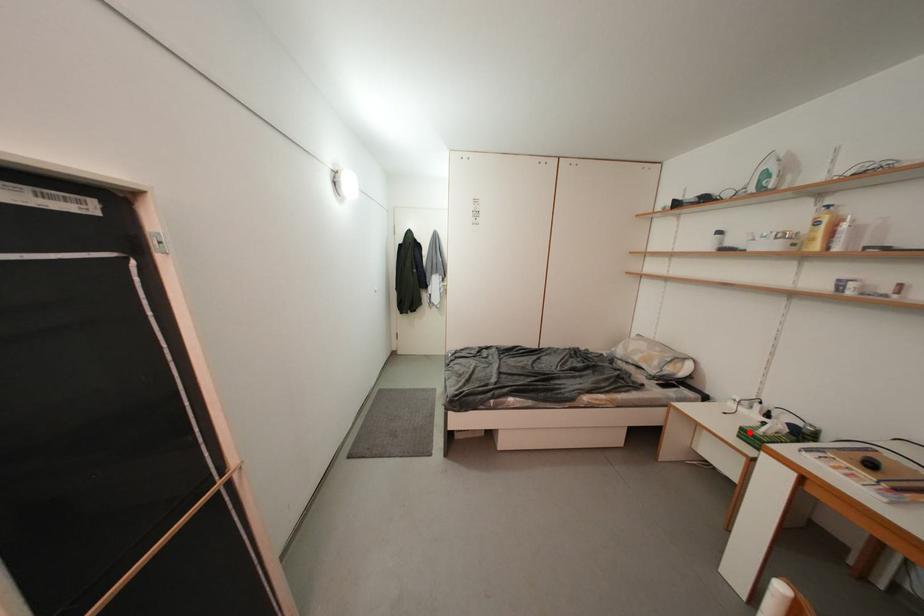
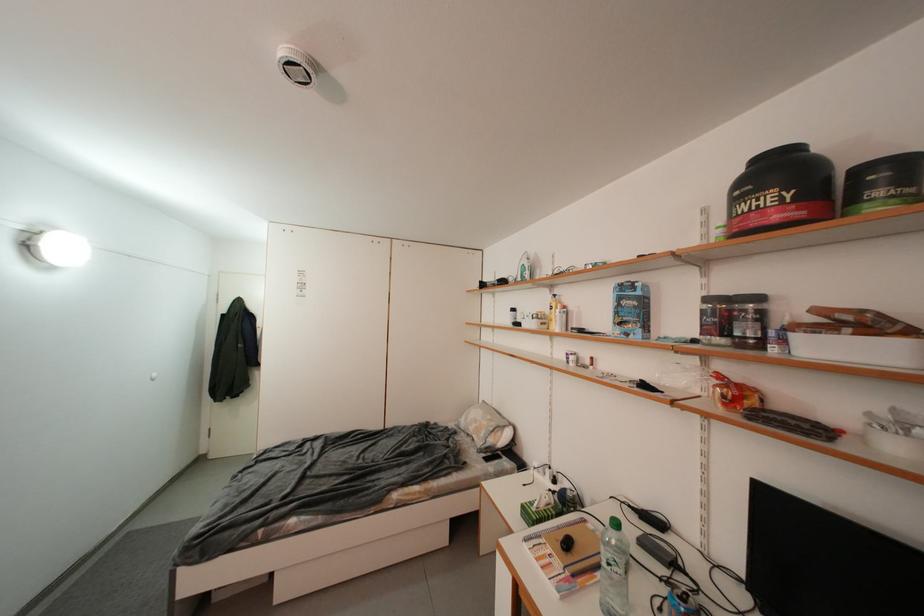
In the second image, find the point that corresponds to the highlighted location in the first image.

(530, 509)